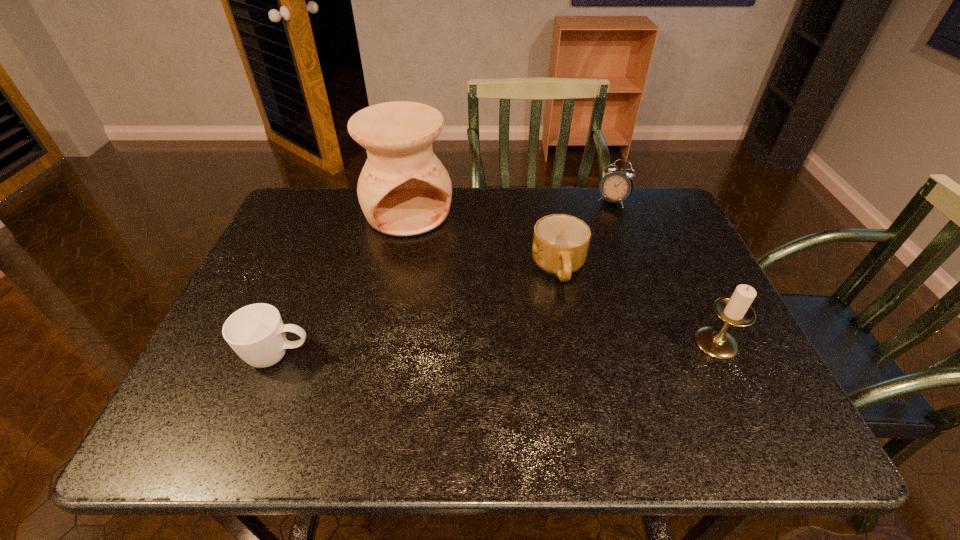
Locate an element on the screen. This screenshot has height=540, width=960. vacant space on the desktop that is between the leftmost object and the rightmost object and is positioned on the side with the handle of the third object from left to right is located at coordinates (551, 348).

At what (x,y) coordinates should I click in order to perform the action: click on free space on the desktop that is between the cup and the candle holder and is positioned on the face of the fourth object from left to right. Please return your answer as a coordinate pair (x, y). The height and width of the screenshot is (540, 960). Looking at the image, I should click on [x=525, y=348].

Find the location of a particular element. free space on the desktop that is between the cup and the rightmost object and is positioned at the open side of the second object from left to right is located at coordinates (479, 350).